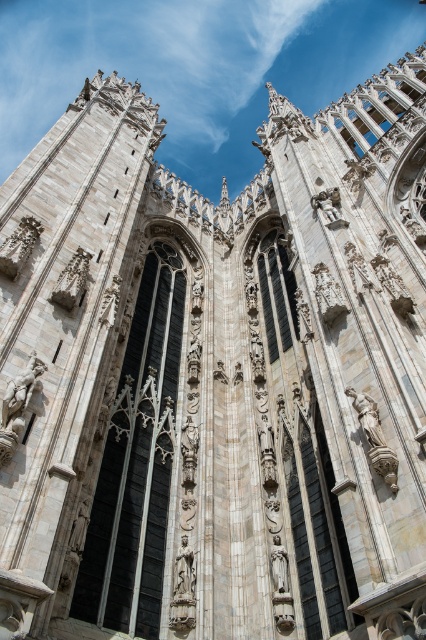
You are standing at the base of the cathedral and want to take a photo of the point located at coordinates point (x=23, y=371). If your camera has a maximum zoom range of 100 meters, will you be able to capture the point clearly in your photo?

The distance of point (x=23, y=371) from viewer is 52.54 meters, so yes, the camera can capture the point clearly since the distance is within the maximum zoom range of 100 meters.

You are an art student standing in front of the cathedral, and you notice two statues. One is the polished stone statue at center, and the other is the polished stone statue at upper center. Which statue is positioned more to the left when viewed from your perspective?

The polished stone statue at center is positioned more to the left compared to the polished stone statue at upper center, as it is located to the left of the upper statue.

You are an architect analyzing the cathedral facade. You need to locate the polished stone statue at center for a restoration project. According to the coordinate system where the bottom left corner is the origin, what are its coordinates?

The polished stone statue at center is located at coordinates point (184, 573).